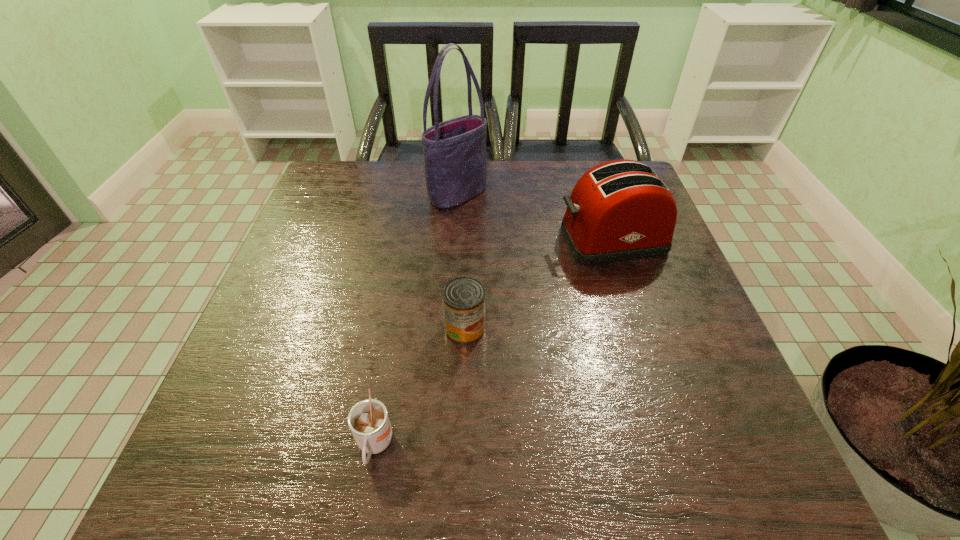
This screenshot has width=960, height=540. I want to click on the tallest object, so click(455, 158).

At what (x,y) coordinates should I click in order to perform the action: click on the farthest object. Please return your answer as a coordinate pair (x, y). Looking at the image, I should click on (455, 158).

Image resolution: width=960 pixels, height=540 pixels. Find the location of `the rightmost object`. the rightmost object is located at coordinates (620, 210).

The height and width of the screenshot is (540, 960). I want to click on the second farthest object, so click(x=620, y=210).

The image size is (960, 540). What are the coordinates of `the third farthest object` in the screenshot? It's located at (463, 298).

This screenshot has width=960, height=540. What are the coordinates of `the leftmost object` in the screenshot? It's located at (368, 420).

Identify the location of cup. (368, 420).

At what (x,y) coordinates should I click in order to perform the action: click on vacant space situated 0.230m on the front of the farthest object. Please return your answer as a coordinate pair (x, y). The width and height of the screenshot is (960, 540). Looking at the image, I should click on (453, 270).

You are a GUI agent. You are given a task and a screenshot of the screen. Output one action in this format:
    pyautogui.click(x=<x>, y=<y>)
    Task: Click on the free space located 0.380m on the front of the third shortest object
    
    Given the screenshot: What is the action you would take?
    pyautogui.click(x=668, y=417)

Where is `free region located 0.160m on the back of the second nearest object`? The image size is (960, 540). free region located 0.160m on the back of the second nearest object is located at coordinates (467, 261).